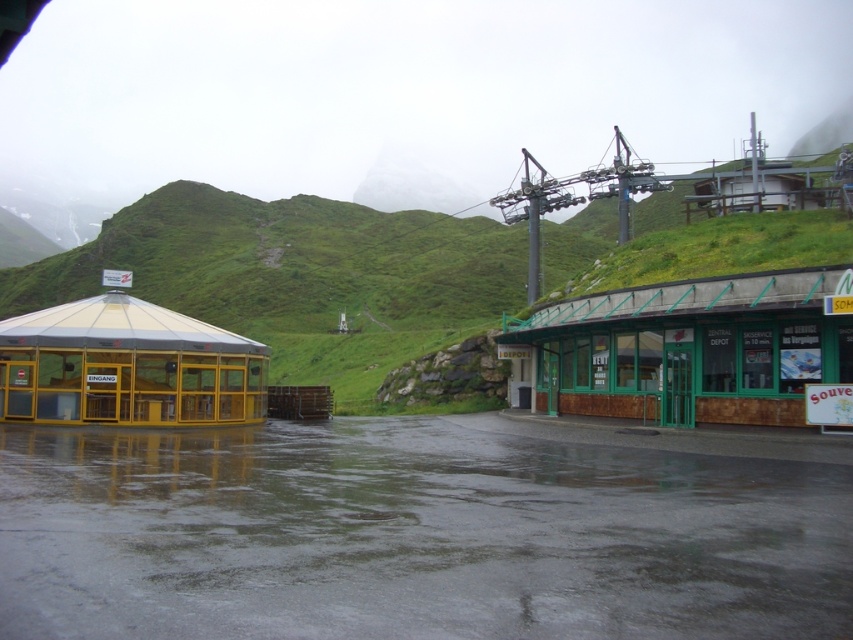
Question: Does green wooden hut at center have a smaller size compared to transparent glass hut at left?

Choices:
 (A) no
 (B) yes

Answer: (A)

Question: Which point appears farthest from the camera in this image?

Choices:
 (A) pyautogui.click(x=775, y=388)
 (B) pyautogui.click(x=210, y=388)

Answer: (B)

Question: Which point is closer to the camera?

Choices:
 (A) green wooden hut at center
 (B) transparent glass hut at left

Answer: (A)

Question: Can you confirm if green wooden hut at center is positioned below transparent glass hut at left?

Choices:
 (A) no
 (B) yes

Answer: (B)

Question: In this image, where is green wooden hut at center located relative to transparent glass hut at left?

Choices:
 (A) left
 (B) right

Answer: (B)

Question: Which point appears closest to the camera in this image?

Choices:
 (A) (564, 392)
 (B) (96, 339)

Answer: (B)